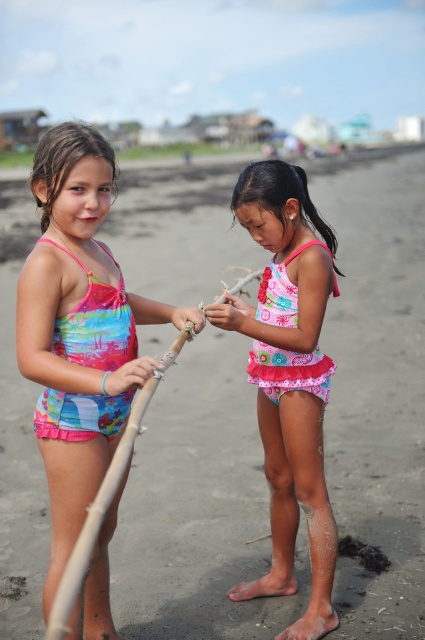
Does multicolored fabric swimsuit at center lie behind pink fabric swimsuit at center?

No, it is in front of pink fabric swimsuit at center.

Between point (47, 346) and point (229, 593), which one is positioned in front?

Point (47, 346) is in front.

Where is `multicolored fabric swimsuit at center`? multicolored fabric swimsuit at center is located at coordinates (79, 330).